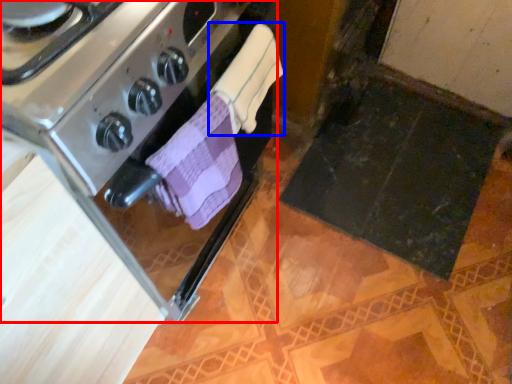
Question: Which object appears closest to the camera in this image, kitchen appliance (highlighted by a red box) or bath towel (highlighted by a blue box)?

Choices:
 (A) kitchen appliance
 (B) bath towel

Answer: (A)